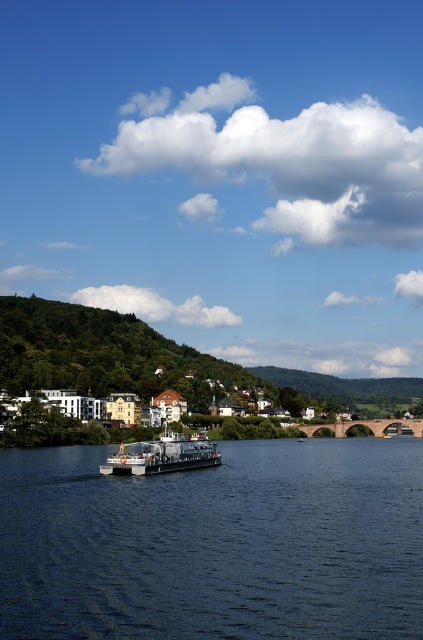
Question: Considering the real-world distances, which object is farthest from the white wooden houses at lower center?

Choices:
 (A) metallic gray ferry at center
 (B) dark blue water at center

Answer: (B)

Question: Does dark blue water at center have a smaller size compared to metallic gray ferry at center?

Choices:
 (A) yes
 (B) no

Answer: (B)

Question: Estimate the real-world distances between objects in this image. Which object is closer to the dark blue water at center?

Choices:
 (A) metallic gray ferry at center
 (B) white wooden houses at lower center

Answer: (A)

Question: Which point is closer to the camera?

Choices:
 (A) white wooden houses at lower center
 (B) metallic gray ferry at center
 (C) dark blue water at center

Answer: (C)

Question: Is dark blue water at center closer to the viewer compared to metallic gray ferry at center?

Choices:
 (A) no
 (B) yes

Answer: (B)

Question: Does white wooden houses at lower center have a greater width compared to metallic gray ferry at center?

Choices:
 (A) no
 (B) yes

Answer: (B)